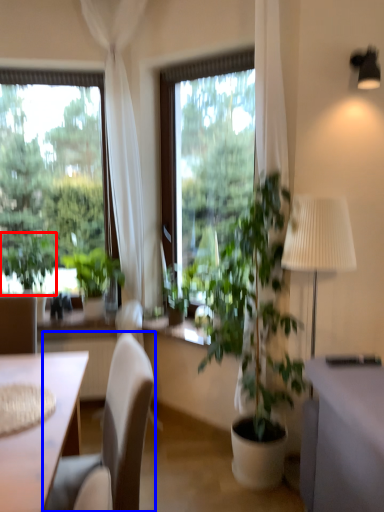
Question: Which of the following is the farthest to the observer, plant (highlighted by a red box) or chair (highlighted by a blue box)?

Choices:
 (A) plant
 (B) chair

Answer: (A)